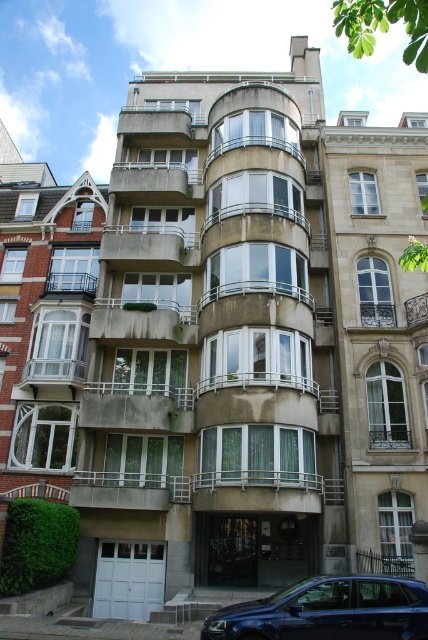
Question: Is shiny blue sedan at lower center above concrete at center?

Choices:
 (A) no
 (B) yes

Answer: (A)

Question: Which of the following is the closest to the observer?

Choices:
 (A) concrete at center
 (B) white concrete balcony at center

Answer: (B)

Question: Among these points, which one is farthest from the camera?

Choices:
 (A) (110, 476)
 (B) (121, 241)
 (C) (362, 614)
 (D) (94, 410)

Answer: (B)

Question: Is white concrete balcony at center wider than concrete at center?

Choices:
 (A) no
 (B) yes

Answer: (B)

Question: Which of the following is the closest to the observer?

Choices:
 (A) (115, 385)
 (B) (122, 504)
 (C) (386, 596)
 (D) (145, 260)

Answer: (C)

Question: Is white concrete balcony at center closer to camera compared to concrete balcony at center?

Choices:
 (A) yes
 (B) no

Answer: (B)